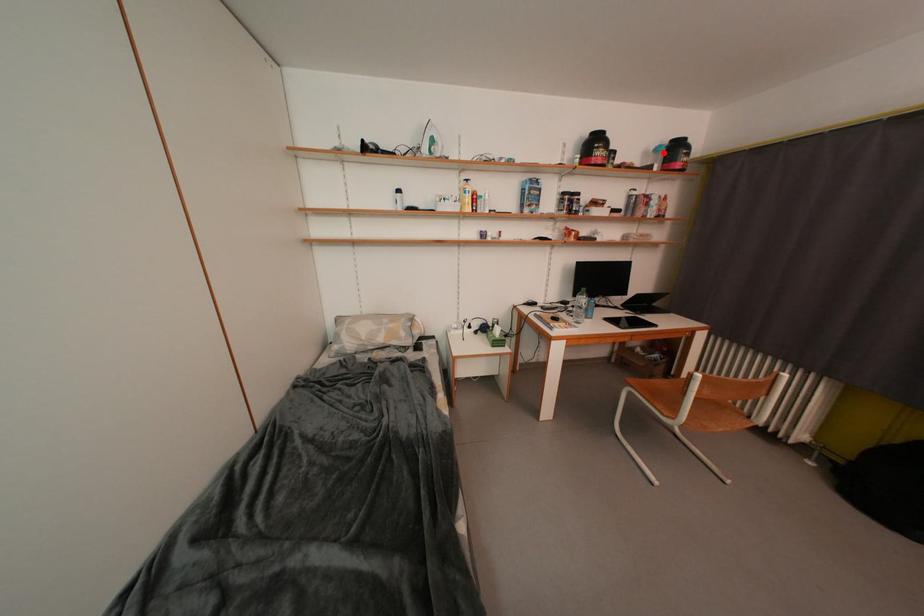
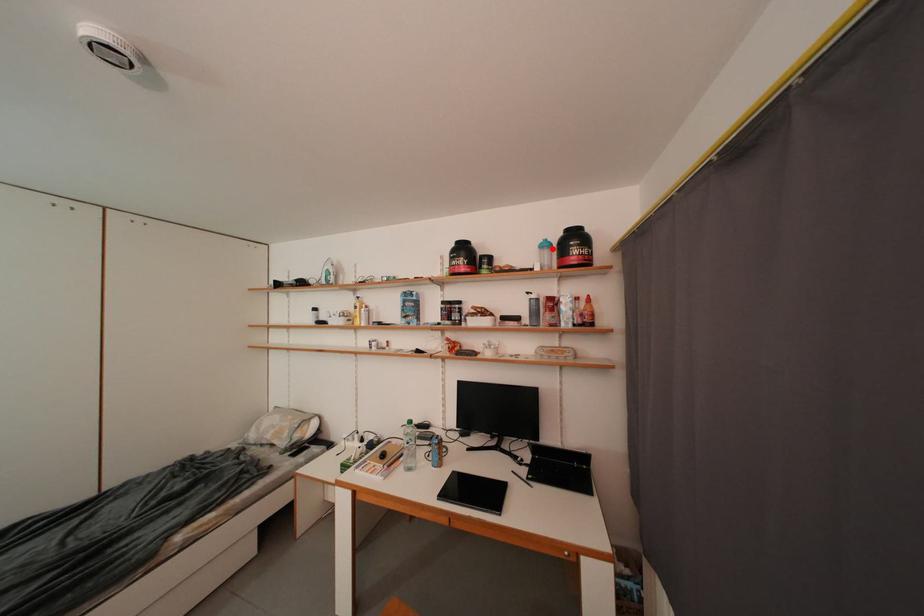
I am providing you with two images of the same scene from different viewpoints. A red point is marked on the first image and another point is marked on the second image. Is the red point in image1 aligned with the point shown in image2?

Yes